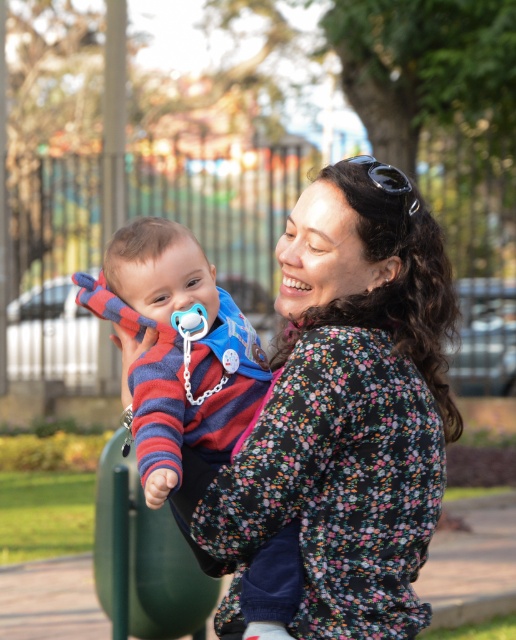
Which of these two, floral print blouse at center or striped fabric baby at center, stands shorter?

Standing shorter between the two is striped fabric baby at center.

Between point (392, 323) and point (138, 266), which one is positioned in front?

Point (392, 323)

Which is behind, point (291, 483) or point (137, 292)?

The point (137, 292) is more distant.

I want to click on floral print blouse at center, so click(346, 435).